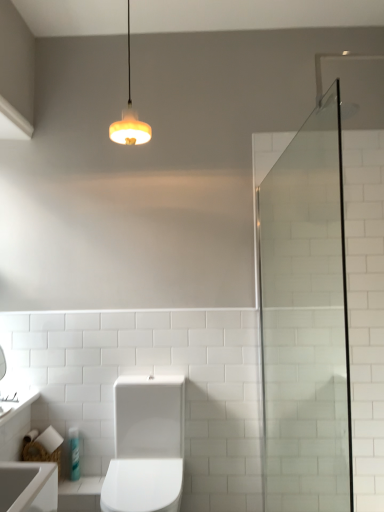
Question: Is translucent plastic bottle at lower left thinner than clear glass shower door at right?

Choices:
 (A) yes
 (B) no

Answer: (A)

Question: Considering the relative positions of translucent plastic bottle at lower left and clear glass shower door at right in the image provided, is translucent plastic bottle at lower left in front of clear glass shower door at right?

Choices:
 (A) yes
 (B) no

Answer: (B)

Question: From a real-world perspective, is translucent plastic bottle at lower left located higher than clear glass shower door at right?

Choices:
 (A) yes
 (B) no

Answer: (B)

Question: Is translucent plastic bottle at lower left bigger than clear glass shower door at right?

Choices:
 (A) yes
 (B) no

Answer: (B)

Question: Is clear glass shower door at right at the back of translucent plastic bottle at lower left?

Choices:
 (A) yes
 (B) no

Answer: (B)

Question: From a real-world perspective, is white glossy sink at lower left physically located above or below white glossy toilet at center?

Choices:
 (A) below
 (B) above

Answer: (B)

Question: Visually, is white glossy sink at lower left positioned to the left or to the right of white glossy toilet at center?

Choices:
 (A) right
 (B) left

Answer: (B)

Question: Is point (13, 409) positioned closer to the camera than point (127, 485)?

Choices:
 (A) farther
 (B) closer

Answer: (A)

Question: In terms of width, does white glossy sink at lower left look wider or thinner when compared to white glossy toilet at center?

Choices:
 (A) wide
 (B) thin

Answer: (B)

Question: From a real-world perspective, is white glossy toilet at center physically located above or below translucent plastic bottle at lower left?

Choices:
 (A) above
 (B) below

Answer: (A)

Question: Does point pos(167,472) appear closer or farther from the camera than point pos(72,441)?

Choices:
 (A) closer
 (B) farther

Answer: (A)

Question: From their relative heights in the image, would you say white glossy toilet at center is taller or shorter than translucent plastic bottle at lower left?

Choices:
 (A) tall
 (B) short

Answer: (A)

Question: Is white glossy toilet at center in front of or behind translucent plastic bottle at lower left in the image?

Choices:
 (A) front
 (B) behind

Answer: (A)

Question: Considering the positions of translucent plastic bottle at lower left and white glossy sink at lower left in the image, is translucent plastic bottle at lower left bigger or smaller than white glossy sink at lower left?

Choices:
 (A) big
 (B) small

Answer: (B)

Question: Considering the positions of translucent plastic bottle at lower left and white glossy sink at lower left in the image, is translucent plastic bottle at lower left wider or thinner than white glossy sink at lower left?

Choices:
 (A) wide
 (B) thin

Answer: (B)